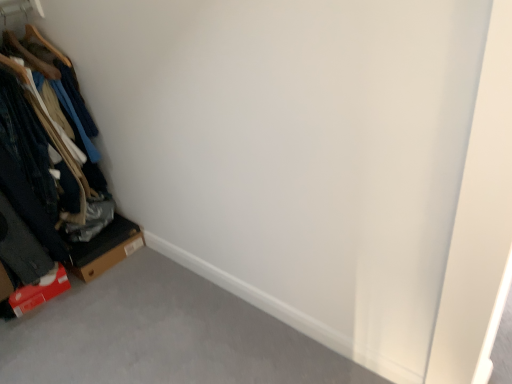
The height and width of the screenshot is (384, 512). What do you see at coordinates (85, 196) in the screenshot?
I see `wooden hangers at left` at bounding box center [85, 196].

This screenshot has width=512, height=384. In order to click on wooden hangers at left in this screenshot , I will do `click(85, 196)`.

Where is `brown cardboard box at lower left`? brown cardboard box at lower left is located at coordinates (104, 249).

What is the approximate height of brown cardboard box at lower left?

It is 5.30 inches.

What do you see at coordinates (104, 249) in the screenshot? I see `brown cardboard box at lower left` at bounding box center [104, 249].

You are a GUI agent. You are given a task and a screenshot of the screen. Output one action in this format:
    pyautogui.click(x=<x>, y=<y>)
    Task: Click on the wooden hangers at left
    Image resolution: width=512 pixels, height=384 pixels.
    Given the screenshot: What is the action you would take?
    pyautogui.click(x=85, y=196)

Which is more to the left, wooden hangers at left or brown cardboard box at lower left?

From the viewer's perspective, wooden hangers at left appears more on the left side.

Is wooden hangers at left in front of or behind brown cardboard box at lower left in the image?

Visually, wooden hangers at left is located in front of brown cardboard box at lower left.

Considering the positions of points (103, 239) and (113, 230), is point (103, 239) closer to camera compared to point (113, 230)?

That is True.

From the image's perspective, which one is positioned higher, wooden hangers at left or brown cardboard box at lower left?

From the image's view, wooden hangers at left is above.

From a real-world perspective, is wooden hangers at left above or below brown cardboard box at lower left?

From a real-world perspective, wooden hangers at left is physically above brown cardboard box at lower left.

Consider the image. Which object is thinner, wooden hangers at left or brown cardboard box at lower left?

Thinner between the two is brown cardboard box at lower left.

Based on the photo, is wooden hangers at left taller than brown cardboard box at lower left?

Indeed, wooden hangers at left has a greater height compared to brown cardboard box at lower left.

Looking at this image, in terms of size, does wooden hangers at left appear bigger or smaller than brown cardboard box at lower left?

Clearly, wooden hangers at left is larger in size than brown cardboard box at lower left.

Is brown cardboard box at lower left completely or partially inside wooden hangers at left?

No, brown cardboard box at lower left is not inside wooden hangers at left.

Is wooden hangers at left placed right next to brown cardboard box at lower left?

wooden hangers at left and brown cardboard box at lower left are clearly separated.

Is wooden hangers at left oriented towards brown cardboard box at lower left?

No, wooden hangers at left does not turn towards brown cardboard box at lower left.

Can you tell me how much wooden hangers at left and brown cardboard box at lower left differ in facing direction?

wooden hangers at left and brown cardboard box at lower left are facing 7.54e-06 degrees away from each other.

Where is `furniture in front of the brown cardboard box at lower left`? This screenshot has width=512, height=384. furniture in front of the brown cardboard box at lower left is located at coordinates (85, 196).

Would you say brown cardboard box at lower left is to the left or to the right of wooden hangers at left in the picture?

In the image, brown cardboard box at lower left appears on the right side of wooden hangers at left.

Considering the positions of objects brown cardboard box at lower left and wooden hangers at left in the image provided, who is in front, brown cardboard box at lower left or wooden hangers at left?

Positioned in front is wooden hangers at left.

Which is further, (104, 269) or (71, 192)?

The point (104, 269) is more distant.

From the image's perspective, is brown cardboard box at lower left positioned above or below wooden hangers at left?

brown cardboard box at lower left is below wooden hangers at left.

From a real-world perspective, which is physically below, brown cardboard box at lower left or wooden hangers at left?

brown cardboard box at lower left is physically lower.

Considering the sizes of objects brown cardboard box at lower left and wooden hangers at left in the image provided, who is thinner, brown cardboard box at lower left or wooden hangers at left?

brown cardboard box at lower left.

Between brown cardboard box at lower left and wooden hangers at left, which one has less height?

With less height is brown cardboard box at lower left.

Based on their sizes in the image, would you say brown cardboard box at lower left is bigger or smaller than wooden hangers at left?

Clearly, brown cardboard box at lower left is smaller in size than wooden hangers at left.

Do you think brown cardboard box at lower left is within wooden hangers at left, or outside of it?

brown cardboard box at lower left is not inside wooden hangers at left, it's outside.

Is the surface of brown cardboard box at lower left in direct contact with wooden hangers at left?

No, brown cardboard box at lower left is not next to wooden hangers at left.

Is brown cardboard box at lower left oriented towards wooden hangers at left?

No, brown cardboard box at lower left is not facing towards wooden hangers at left.

How much distance is there between brown cardboard box at lower left and wooden hangers at left?

brown cardboard box at lower left is 6.02 inches from wooden hangers at left.

This screenshot has height=384, width=512. Identify the location of furniture located above the brown cardboard box at lower left (from a real-world perspective). (85, 196).

In order to click on furniture on the left side of brown cardboard box at lower left in this screenshot , I will do pyautogui.click(x=85, y=196).

You are a GUI agent. You are given a task and a screenshot of the screen. Output one action in this format:
    pyautogui.click(x=<x>, y=<y>)
    Task: Click on the furniture located above the brown cardboard box at lower left (from the image's perspective)
    Image resolution: width=512 pixels, height=384 pixels.
    Given the screenshot: What is the action you would take?
    pyautogui.click(x=85, y=196)